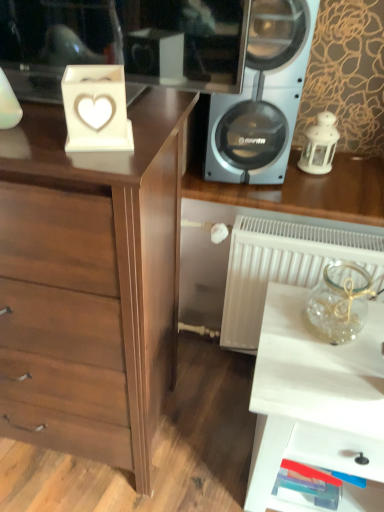
Question: From their relative heights in the image, would you say white porcelain lantern at right is taller or shorter than brown wood chest of drawers at left?

Choices:
 (A) tall
 (B) short

Answer: (B)

Question: Does point (324, 112) appear closer or farther from the camera than point (59, 284)?

Choices:
 (A) closer
 (B) farther

Answer: (B)

Question: Which object is positioned closest to the clear glass jar at right?

Choices:
 (A) white porcelain lantern at right
 (B) white matte heart-shaped object at upper left
 (C) silver metallic speaker at upper right
 (D) brown wood chest of drawers at left
 (E) white glossy table at lower right

Answer: (E)

Question: Based on their relative distances, which object is farther from the silver metallic speaker at upper right?

Choices:
 (A) brown wood chest of drawers at left
 (B) clear glass jar at right
 (C) white porcelain lantern at right
 (D) white glossy table at lower right
 (E) white matte heart-shaped object at upper left

Answer: (E)